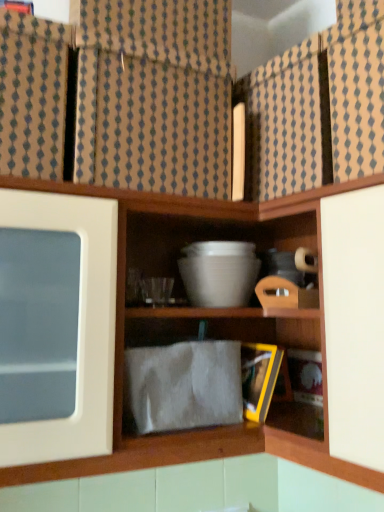
Question: Choose the correct answer: Is white matte bowl at upper center inside brown textured fabric at upper center or outside it?

Choices:
 (A) outside
 (B) inside

Answer: (A)

Question: Based on their sizes in the image, would you say white matte bowl at upper center is bigger or smaller than brown textured fabric at upper center?

Choices:
 (A) small
 (B) big

Answer: (B)

Question: Estimate the real-world distances between objects in this image. Which object is closer to the brown textured fabric at upper center?

Choices:
 (A) white glossy mixing bowl at center
 (B) white matte bowl at upper center

Answer: (B)

Question: Which object is the closest to the brown textured fabric at upper center?

Choices:
 (A) white glossy mixing bowl at center
 (B) white matte bowl at upper center

Answer: (B)